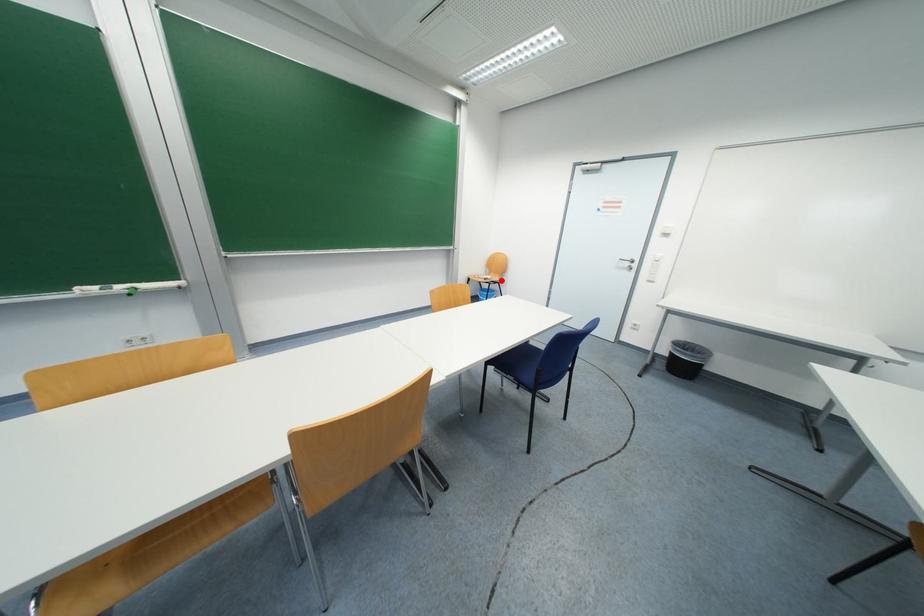
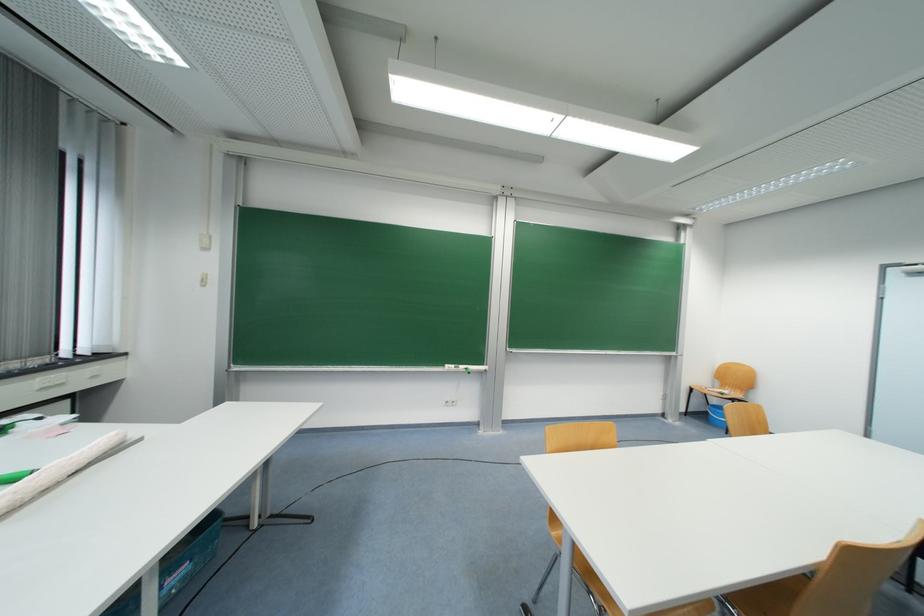
Where in the second image is the point corresponding to the highlighted location from the first image?

(743, 398)